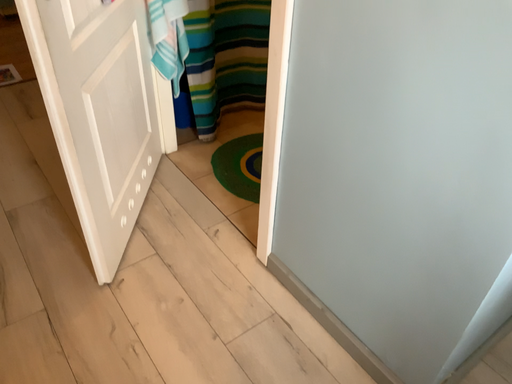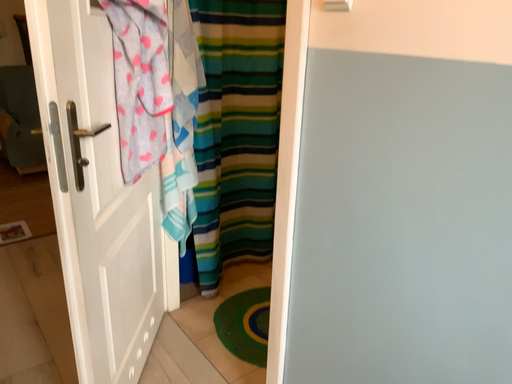
Question: Which way did the camera rotate in the video?

Choices:
 (A) rotated downward
 (B) rotated upward

Answer: (B)